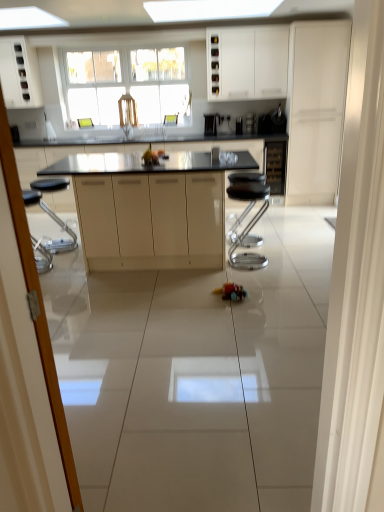
Question: Considering the relative positions of white matte cabinet at upper left, the 5th cabinetry positioned from the right, and shiny plastic toy car at center in the image provided, is white matte cabinet at upper left, the 5th cabinetry positioned from the right, to the right of shiny plastic toy car at center from the viewer's perspective?

Choices:
 (A) yes
 (B) no

Answer: (B)

Question: Does white matte cabinet at upper left, the 5th cabinetry positioned from the right, have a lesser height compared to shiny plastic toy car at center?

Choices:
 (A) no
 (B) yes

Answer: (A)

Question: Is white matte cabinet at upper left, placed as the first cabinetry when sorted from left to right, further to camera compared to shiny plastic toy car at center?

Choices:
 (A) no
 (B) yes

Answer: (B)

Question: Is white matte cabinet at upper left, the 5th cabinetry positioned from the right, facing away from shiny plastic toy car at center?

Choices:
 (A) yes
 (B) no

Answer: (B)

Question: Is shiny plastic toy car at center completely or partially inside white matte cabinet at upper left, the 5th cabinetry positioned from the right?

Choices:
 (A) yes
 (B) no

Answer: (B)

Question: From a real-world perspective, is black glass wine cabinet at center, acting as the second cabinetry starting from the right, physically located above or below black granite countertop at center?

Choices:
 (A) above
 (B) below

Answer: (A)

Question: Is black glass wine cabinet at center, acting as the second cabinetry starting from the right, to the left or to the right of black granite countertop at center in the image?

Choices:
 (A) left
 (B) right

Answer: (B)

Question: In terms of height, does black glass wine cabinet at center, marked as the 4th cabinetry in a left-to-right arrangement, look taller or shorter compared to black granite countertop at center?

Choices:
 (A) tall
 (B) short

Answer: (B)

Question: Choose the correct answer: Is black glass wine cabinet at center, acting as the second cabinetry starting from the right, inside black granite countertop at center or outside it?

Choices:
 (A) outside
 (B) inside

Answer: (B)

Question: Relative to transparent glass screen door at left, is satin black coffee machine at center, which appears as the second appliance when viewed from the left, in front or behind?

Choices:
 (A) behind
 (B) front

Answer: (A)

Question: From a real-world perspective, is satin black coffee machine at center, the second appliance viewed from the right, above or below transparent glass screen door at left?

Choices:
 (A) above
 (B) below

Answer: (A)

Question: Is satin black coffee machine at center, which appears as the second appliance when viewed from the left, taller or shorter than transparent glass screen door at left?

Choices:
 (A) short
 (B) tall

Answer: (A)

Question: Is point (236, 117) closer or farther from the camera than point (34, 327)?

Choices:
 (A) farther
 (B) closer

Answer: (A)

Question: In terms of size, does transparent glass screen door at left appear bigger or smaller than matte beige cabinetry at center, the 4th cabinetry in the right-to-left sequence?

Choices:
 (A) small
 (B) big

Answer: (A)

Question: Considering the positions of transparent glass screen door at left and matte beige cabinetry at center, arranged as the 2th cabinetry when viewed from the left, in the image, is transparent glass screen door at left taller or shorter than matte beige cabinetry at center, arranged as the 2th cabinetry when viewed from the left,?

Choices:
 (A) tall
 (B) short

Answer: (A)